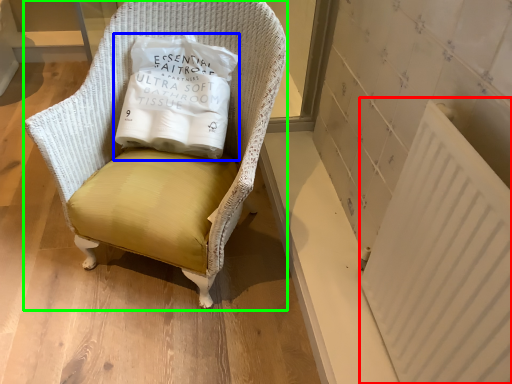
Question: Which object is positioned closest to radiator (highlighted by a red box)? Select from pillow (highlighted by a blue box) and chair (highlighted by a green box).

Choices:
 (A) pillow
 (B) chair

Answer: (B)